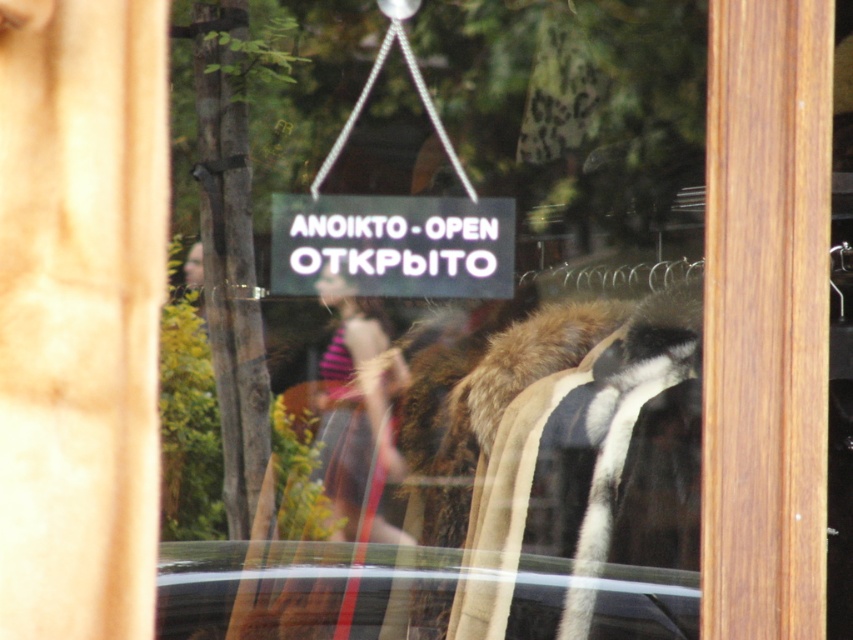
You are a customer trying to decide between two items displayed in the store window. The fur coat at center and the striped fabric at center are both visible. Which item is wider?

The fur coat at center is wider than the striped fabric at center.

You are standing outside the store looking through the window. You see a fur coat at center and a striped fabric at center. Which object is positioned to the right in the window display?

The fur coat at center is to the right of the striped fabric at center.

You are a customer standing outside the store looking through the window. You see a fur coat at center and a black plastic sign at center. Which object appears wider in the window?

The fur coat at center appears wider than the black plastic sign at center because its width is larger than the sign.